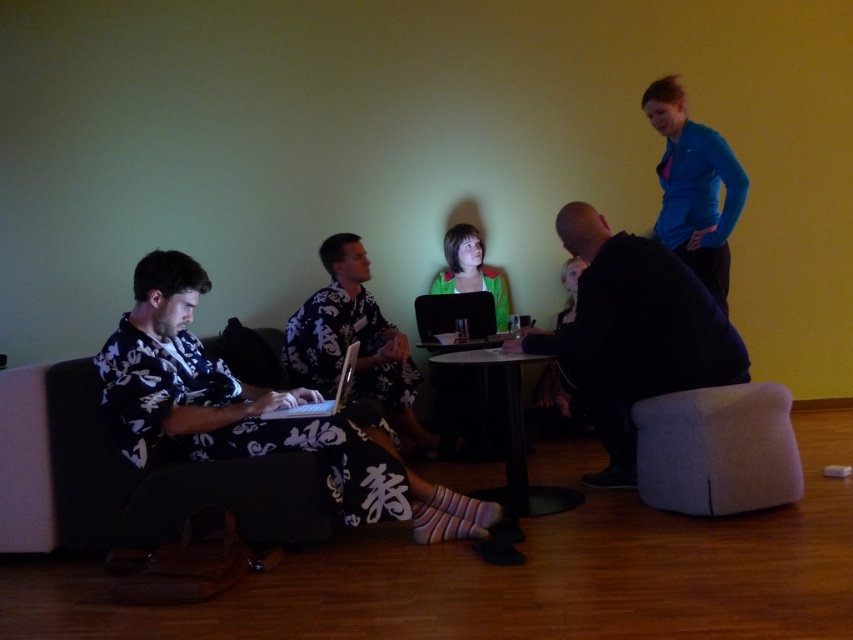
Does black fabric armchair at left appear over black plastic table at center?

Incorrect, black fabric armchair at left is not positioned above black plastic table at center.

Is point (267, 532) closer to viewer compared to point (503, 403)?

Yes, point (267, 532) is closer to viewer.

Locate an element on the screen. The height and width of the screenshot is (640, 853). black fabric armchair at left is located at coordinates (128, 477).

Is blue fleece jacket at upper right closer to camera compared to matte black laptop at center?

No, it is not.

In the scene shown: Can you confirm if blue fleece jacket at upper right is smaller than matte black laptop at center?

Incorrect, blue fleece jacket at upper right is not smaller in size than matte black laptop at center.

You are a GUI agent. You are given a task and a screenshot of the screen. Output one action in this format:
    pyautogui.click(x=<x>, y=<y>)
    Task: Click on the blue fleece jacket at upper right
    
    Given the screenshot: What is the action you would take?
    pyautogui.click(x=694, y=188)

This screenshot has width=853, height=640. Find the location of `blue fleece jacket at upper right`. blue fleece jacket at upper right is located at coordinates pyautogui.click(x=694, y=188).

Who is higher up, blue fleece jacket at upper right or black plastic table at center?

blue fleece jacket at upper right is higher up.

Is blue fleece jacket at upper right bigger than black plastic table at center?

No.

Measure the distance between blue fleece jacket at upper right and camera.

The distance of blue fleece jacket at upper right from camera is 10.95 feet.

This screenshot has width=853, height=640. In order to click on blue fleece jacket at upper right in this screenshot , I will do `click(694, 188)`.